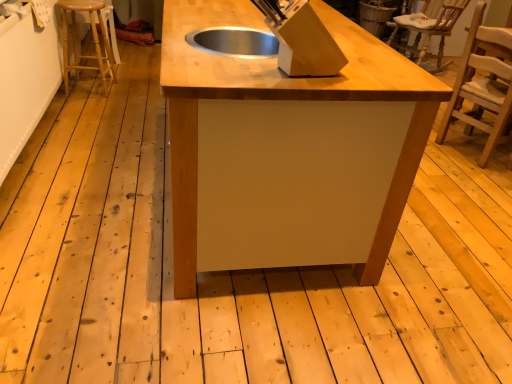
The width and height of the screenshot is (512, 384). Find the location of `free point in front of light brown wooden chair at right, marked as the 2th chair in a back-to-front arrangement`. free point in front of light brown wooden chair at right, marked as the 2th chair in a back-to-front arrangement is located at coordinates (469, 180).